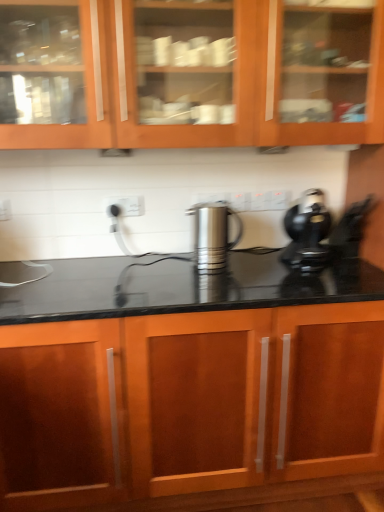
Question: From the image's perspective, relative to satin silver kettle at center, is black plastic coffee maker at right above or below?

Choices:
 (A) below
 (B) above

Answer: (B)

Question: Is black plastic coffee maker at right to the left or to the right of satin silver kettle at center in the image?

Choices:
 (A) left
 (B) right

Answer: (B)

Question: Estimate the real-world distances between objects in this image. Which object is closer to the satin silver kettle at center?

Choices:
 (A) wooden cabinet at upper center, the second cabinetry when ordered from bottom to top
 (B) wooden cabinet at center, arranged as the second cabinetry when viewed from the top
 (C) black plastic coffee maker at right

Answer: (C)

Question: Based on their relative distances, which object is farther from the black plastic coffee maker at right?

Choices:
 (A) satin silver kettle at center
 (B) wooden cabinet at center, the first cabinetry when ordered from bottom to top
 (C) wooden cabinet at upper center, the second cabinetry when ordered from bottom to top

Answer: (C)